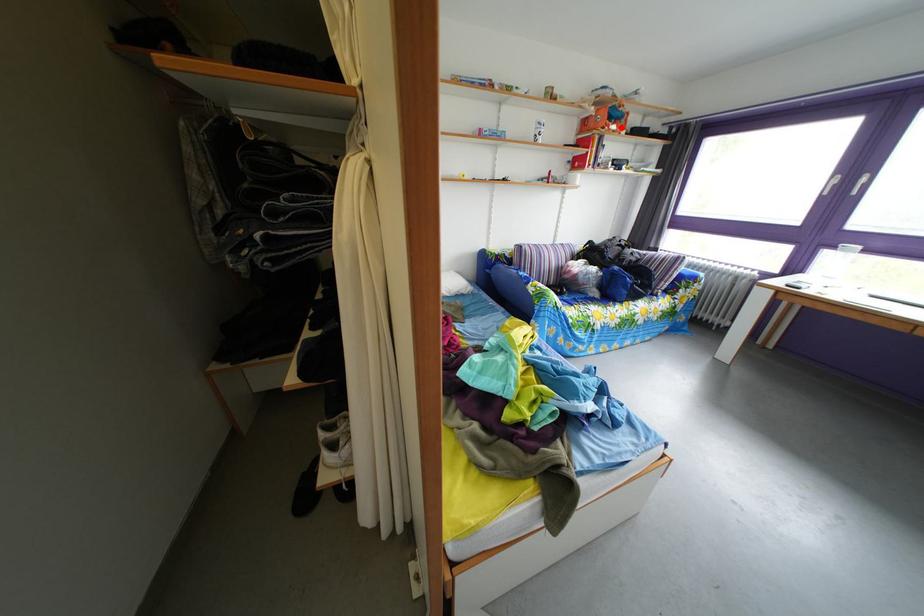
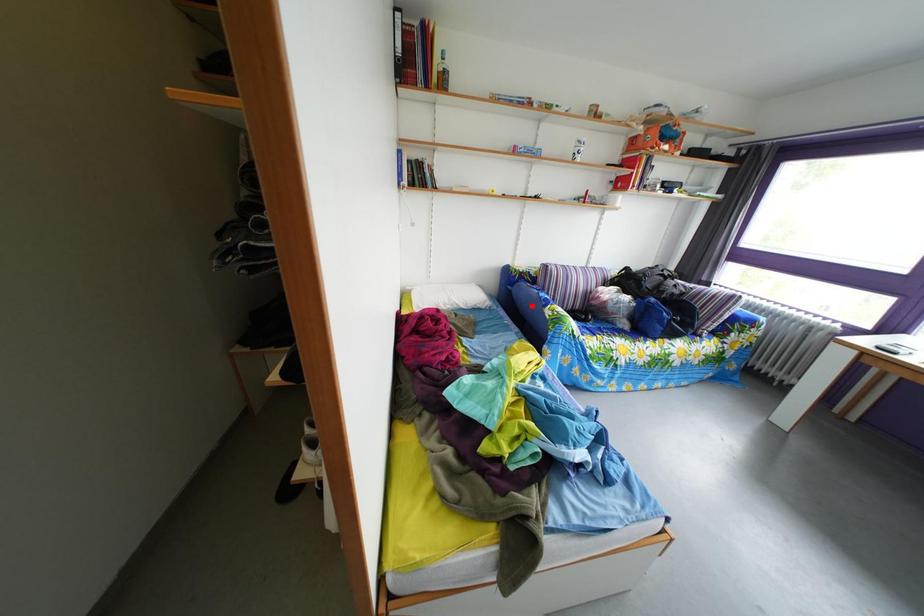
I am providing you with two images of the same scene from different viewpoints. A red point is marked on the first image and another point is marked on the second image. Do the highlighted points in image1 and image2 indicate the same real-world spot?

No